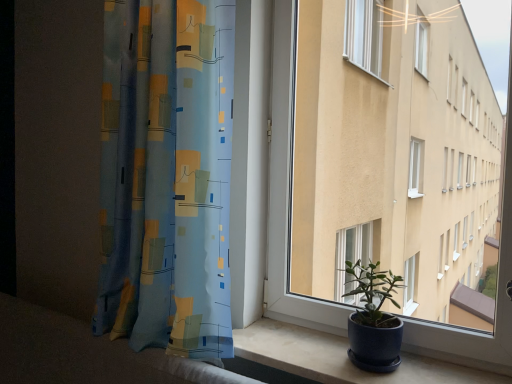
This screenshot has width=512, height=384. Find the location of `empty space that is in between matte white window at center and matte blue pot at lower right`. empty space that is in between matte white window at center and matte blue pot at lower right is located at coordinates (346, 355).